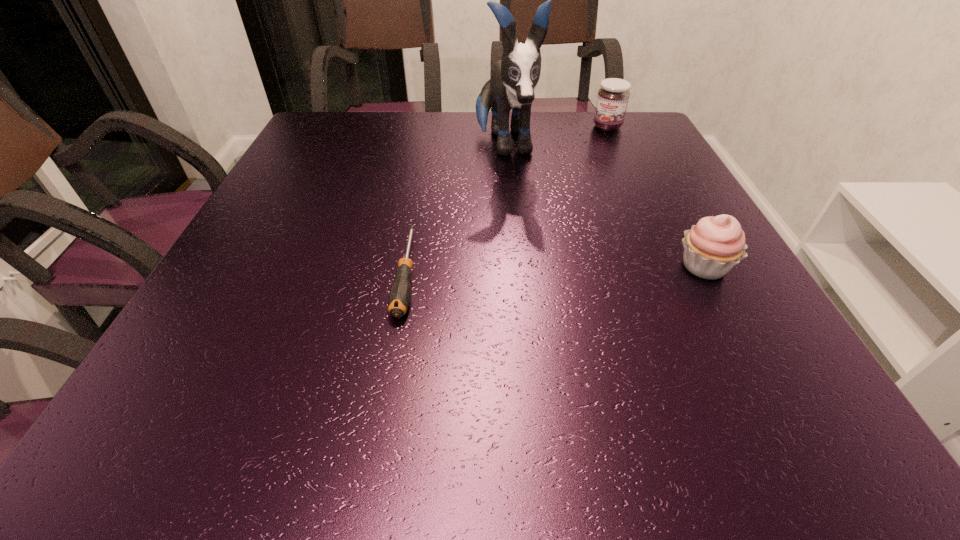
In order to click on free spot on the desktop that is between the shortest object and the cupcake and is positioned on the front label of the jam in this screenshot , I will do `click(533, 270)`.

You are a GUI agent. You are given a task and a screenshot of the screen. Output one action in this format:
    pyautogui.click(x=<x>, y=<y>)
    Task: Click on the vacant space on the desktop that is between the shortest object and the cupcake and is positioned on the front-facing side of the second object from left to right
    
    Given the screenshot: What is the action you would take?
    pyautogui.click(x=541, y=270)